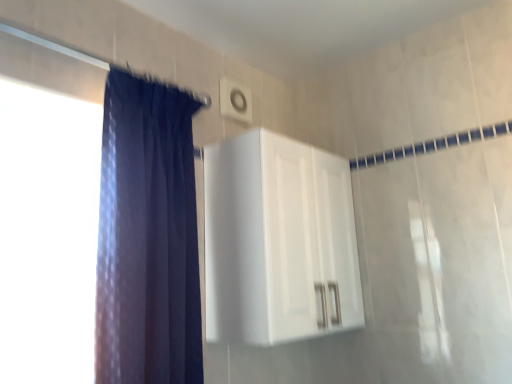
Question: From the image's perspective, is dark blue fabric at left located above white glossy cabinet at upper center?

Choices:
 (A) yes
 (B) no

Answer: (A)

Question: Is dark blue fabric at left far away from white glossy cabinet at upper center?

Choices:
 (A) yes
 (B) no

Answer: (B)

Question: Does dark blue fabric at left have a greater height compared to white glossy cabinet at upper center?

Choices:
 (A) no
 (B) yes

Answer: (B)

Question: From the image's perspective, would you say dark blue fabric at left is shown under white glossy cabinet at upper center?

Choices:
 (A) yes
 (B) no

Answer: (B)

Question: Is the depth of dark blue fabric at left less than that of white glossy cabinet at upper center?

Choices:
 (A) yes
 (B) no

Answer: (A)

Question: Considering the relative sizes of dark blue fabric at left and white glossy cabinet at upper center in the image provided, is dark blue fabric at left wider than white glossy cabinet at upper center?

Choices:
 (A) no
 (B) yes

Answer: (A)

Question: From a real-world perspective, does white glossy cabinet at upper center sit lower than dark blue fabric at left?

Choices:
 (A) yes
 (B) no

Answer: (A)

Question: Considering the relative sizes of white glossy cabinet at upper center and dark blue fabric at left in the image provided, is white glossy cabinet at upper center shorter than dark blue fabric at left?

Choices:
 (A) yes
 (B) no

Answer: (A)

Question: Considering the relative sizes of white glossy cabinet at upper center and dark blue fabric at left in the image provided, is white glossy cabinet at upper center smaller than dark blue fabric at left?

Choices:
 (A) yes
 (B) no

Answer: (B)

Question: Would you say dark blue fabric at left is part of white glossy cabinet at upper center's contents?

Choices:
 (A) no
 (B) yes

Answer: (A)

Question: Can you confirm if white glossy cabinet at upper center is wider than dark blue fabric at left?

Choices:
 (A) no
 (B) yes

Answer: (B)

Question: Would you say white glossy cabinet at upper center is outside dark blue fabric at left?

Choices:
 (A) no
 (B) yes

Answer: (B)

Question: Is white plastic light switch at upper center not inside dark blue fabric at left?

Choices:
 (A) no
 (B) yes

Answer: (B)